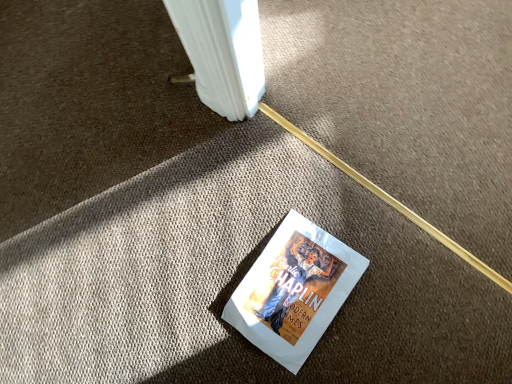
Locate an element on the screen. This screenshot has width=512, height=384. vacant point to the left of white paper at center is located at coordinates (195, 309).